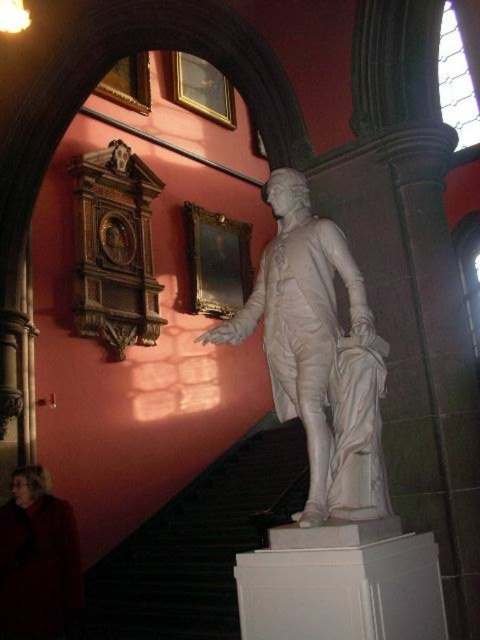
Does black marble stairs at center have a lesser width compared to velvet red coat at lower left?

No.

In the scene shown: Which is more to the left, black marble stairs at center or velvet red coat at lower left?

velvet red coat at lower left is more to the left.

Is point (288, 440) positioned before point (45, 564)?

No, (288, 440) is further to viewer.

I want to click on black marble stairs at center, so click(x=197, y=545).

Can you confirm if white marble statue at center is taller than black marble stairs at center?

No.

Is point (368, 342) farther from camera compared to point (156, 570)?

No, (368, 342) is in front of (156, 570).

The height and width of the screenshot is (640, 480). I want to click on white marble statue at center, so click(319, 355).

Is point (331, 253) more distant than point (33, 570)?

No, (331, 253) is in front of (33, 570).

Identify the location of white marble statue at center. The width and height of the screenshot is (480, 640). pyautogui.click(x=319, y=355).